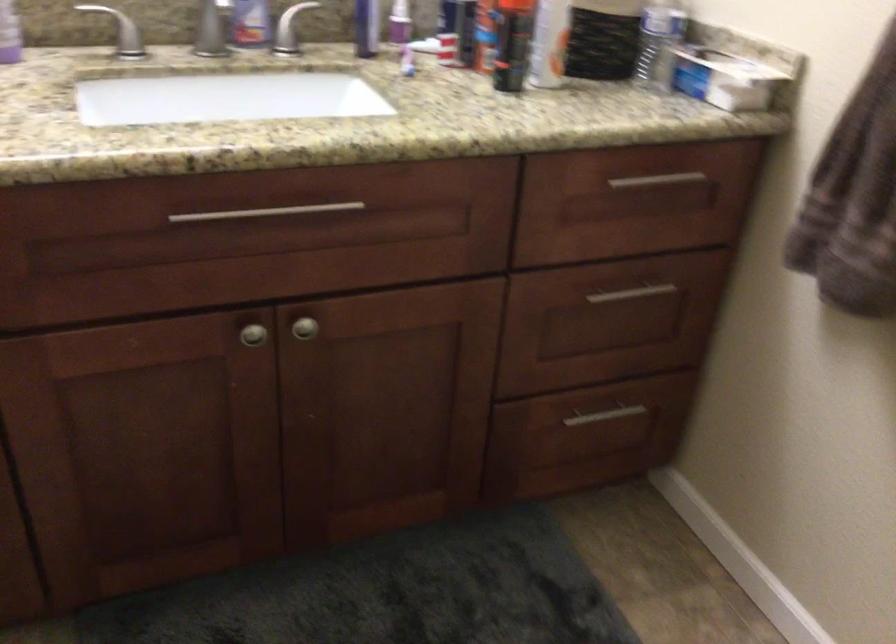
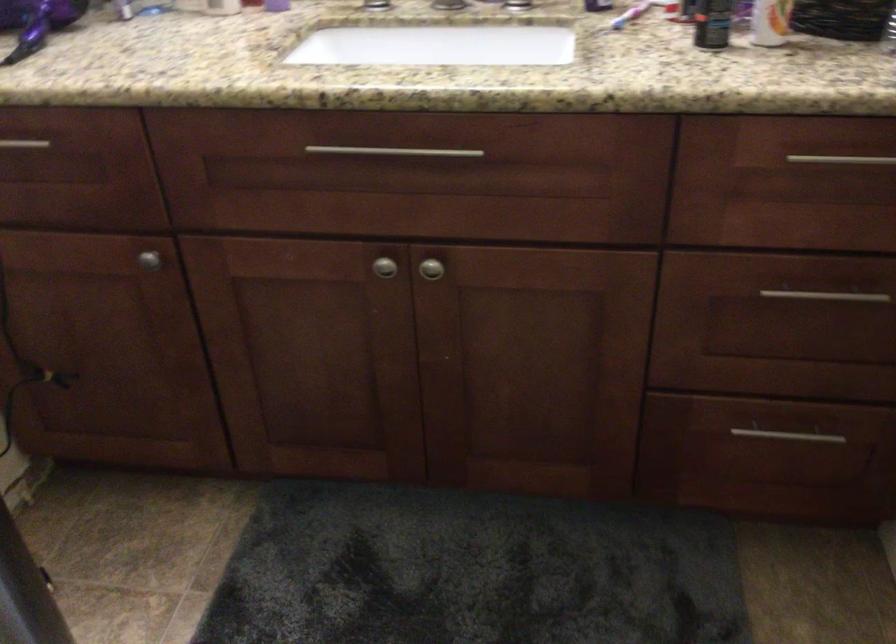
Where in the second image is the point corresponding to (x=556, y=71) from the first image?

(770, 22)